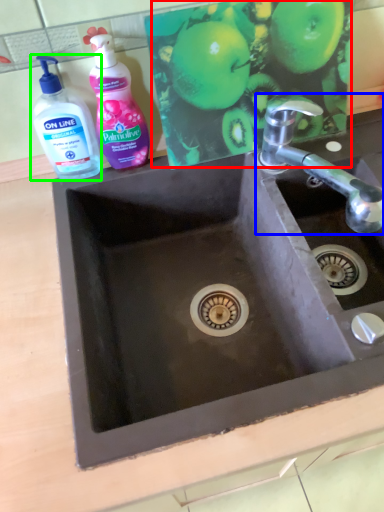
Question: Estimate the real-world distances between objects in this image. Which object is farther from apple (highlighted by a red box), tap (highlighted by a blue box) or bottle (highlighted by a green box)?

Choices:
 (A) tap
 (B) bottle

Answer: (B)